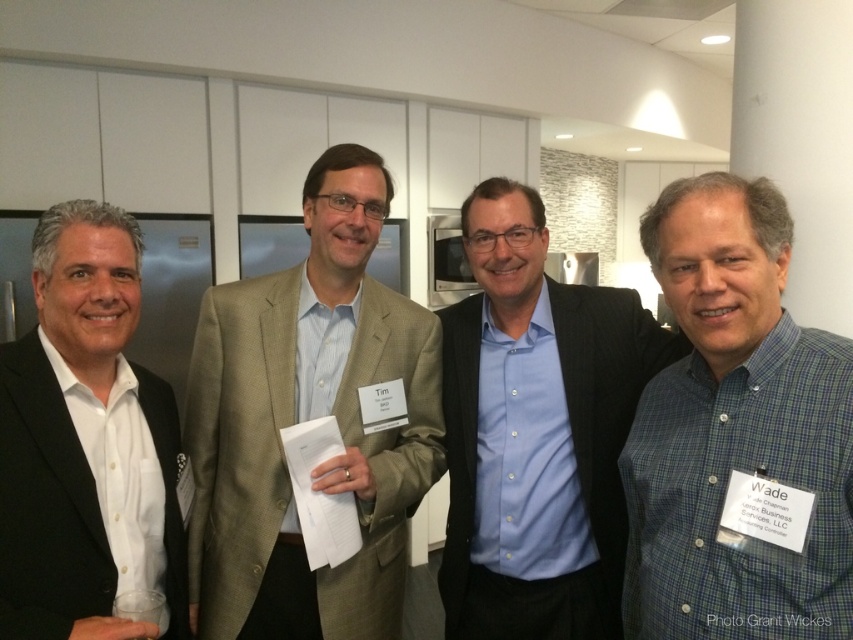
Based on the scene description, which man is wearing the light brown textured suit at center and is he standing to the left or right of the black matte suit at left?

The light brown textured suit at center is positioned over the black matte suit at left, meaning the man wearing the light brown textured suit is standing to the right of the black matte suit at left.